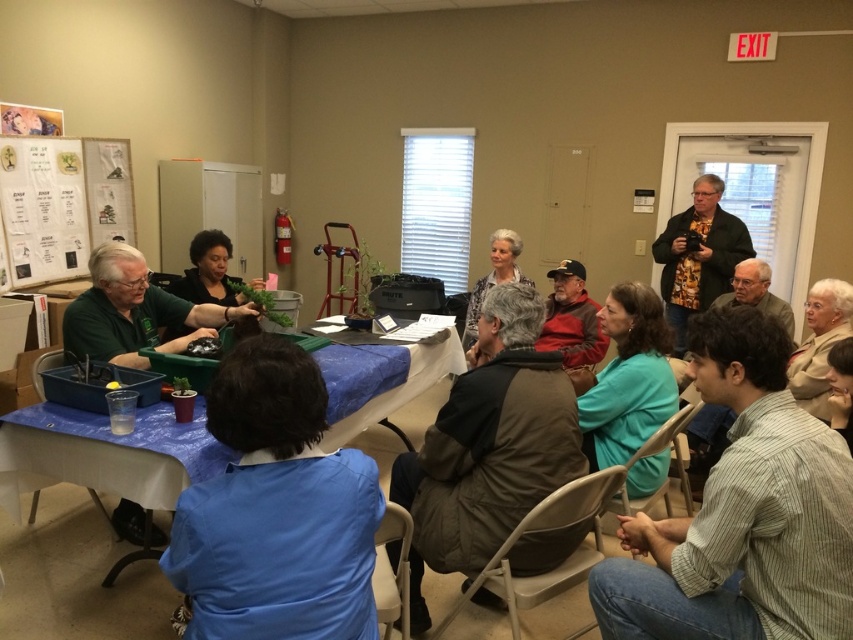
Who is positioned more to the left, green matte shirt at center or matte gray jacket at center?

green matte shirt at center is more to the left.

In the scene shown: Can you confirm if green matte shirt at center is bigger than matte gray jacket at center?

Yes, green matte shirt at center is bigger than matte gray jacket at center.

This screenshot has width=853, height=640. I want to click on green matte shirt at center, so coord(135,310).

The width and height of the screenshot is (853, 640). I want to click on striped cotton shirt at lower right, so click(743, 513).

Locate an element on the screen. Image resolution: width=853 pixels, height=640 pixels. striped cotton shirt at lower right is located at coordinates (743, 513).

Where is `floral-patterned shirt at upper right`? floral-patterned shirt at upper right is located at coordinates (698, 257).

Between floral-patterned shirt at upper right and red fleece jacket at center, which one has less height?

red fleece jacket at center is shorter.

The image size is (853, 640). What are the coordinates of `floral-patterned shirt at upper right` in the screenshot? It's located at (698, 257).